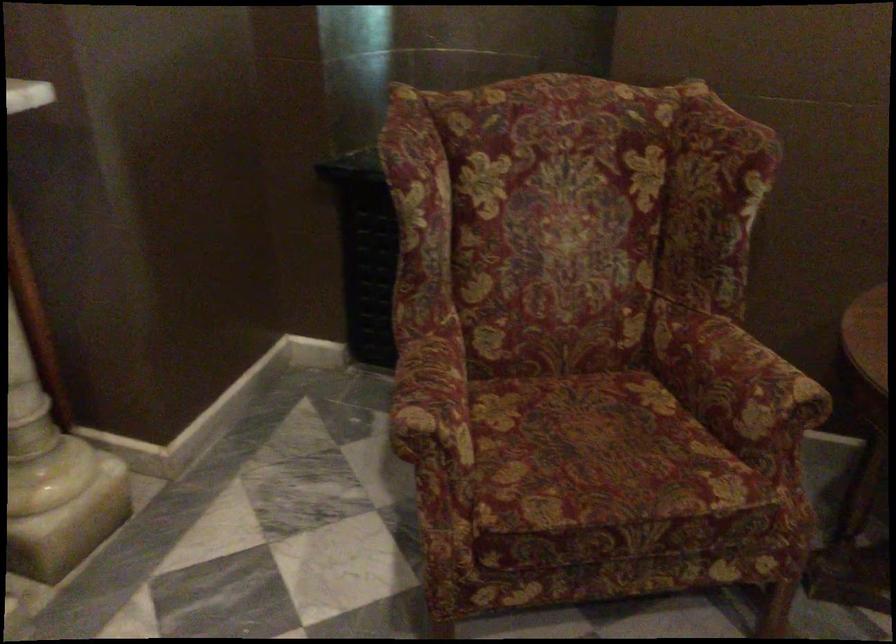
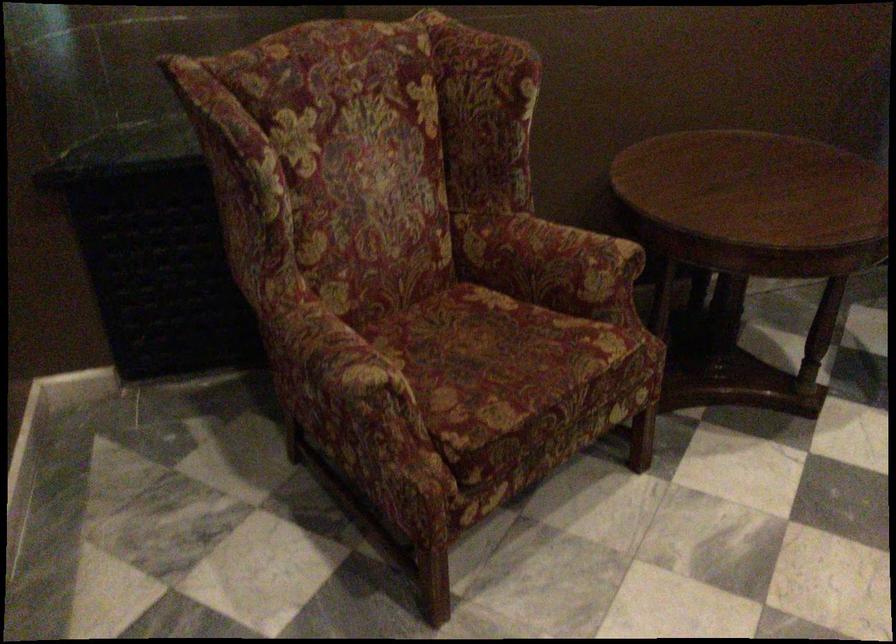
Find the pixel in the second image that matches point (393, 424) in the first image.

(343, 389)